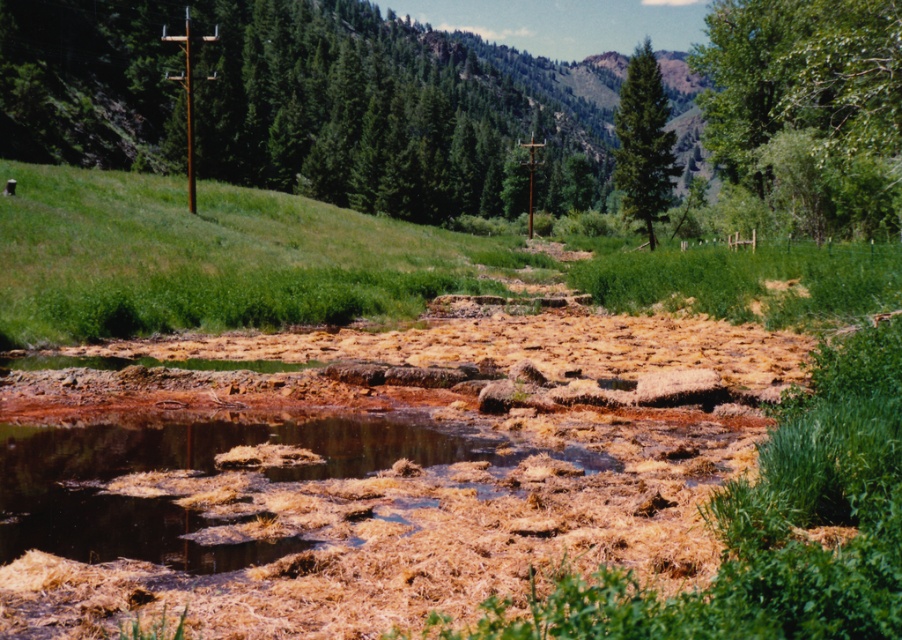
Is point (284, 435) positioned behind point (637, 49)?

No.

Who is positioned more to the left, brown organic debris at center or green matte tree at upper center?

brown organic debris at center is more to the left.

From the picture: Who is more forward, (48, 488) or (637, 77)?

Point (48, 488) is more forward.

Where is `brown organic debris at center`? The width and height of the screenshot is (902, 640). brown organic debris at center is located at coordinates (198, 477).